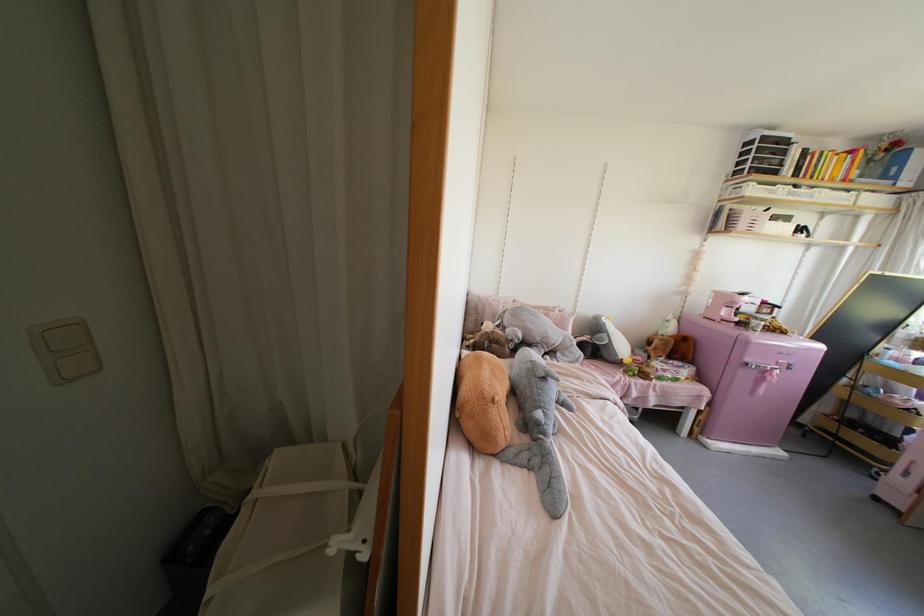
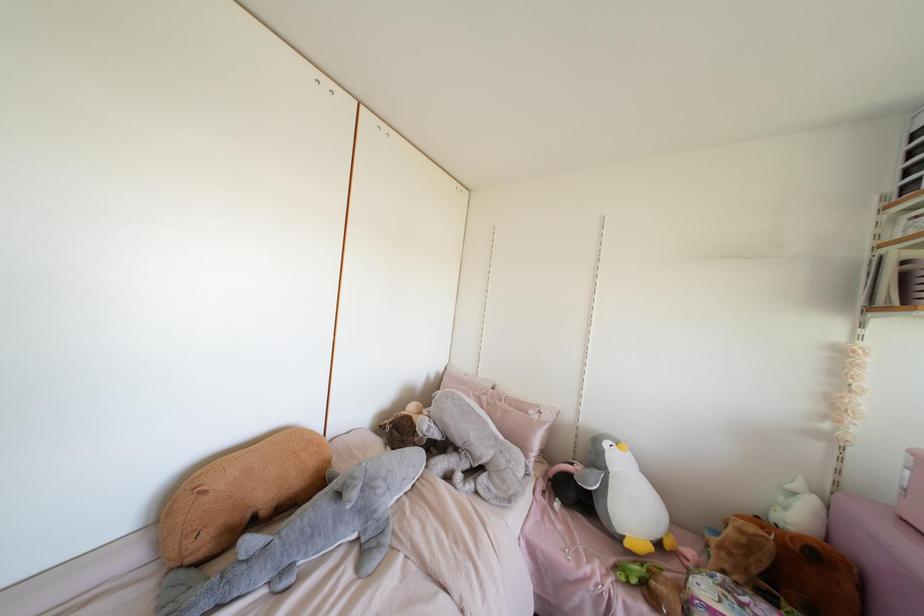
In the second image, find the point that corresponds to the point at 624,361 in the first image.

(626, 544)